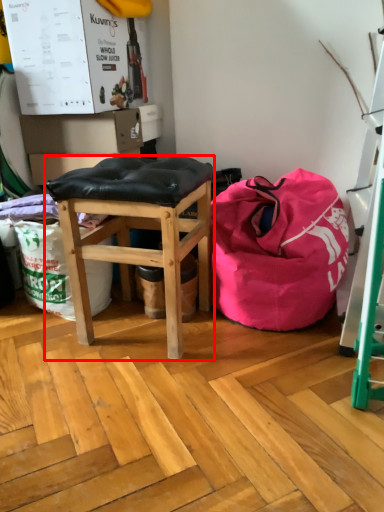
Question: From the image's perspective, what is the correct spatial relationship of stool (annotated by the red box) in relation to bean bag chair?

Choices:
 (A) above
 (B) below

Answer: (B)